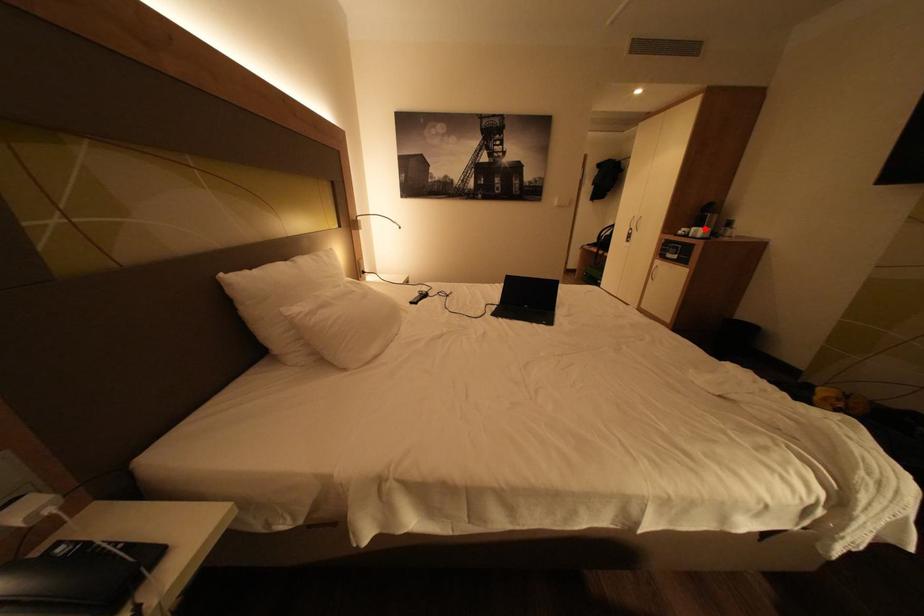
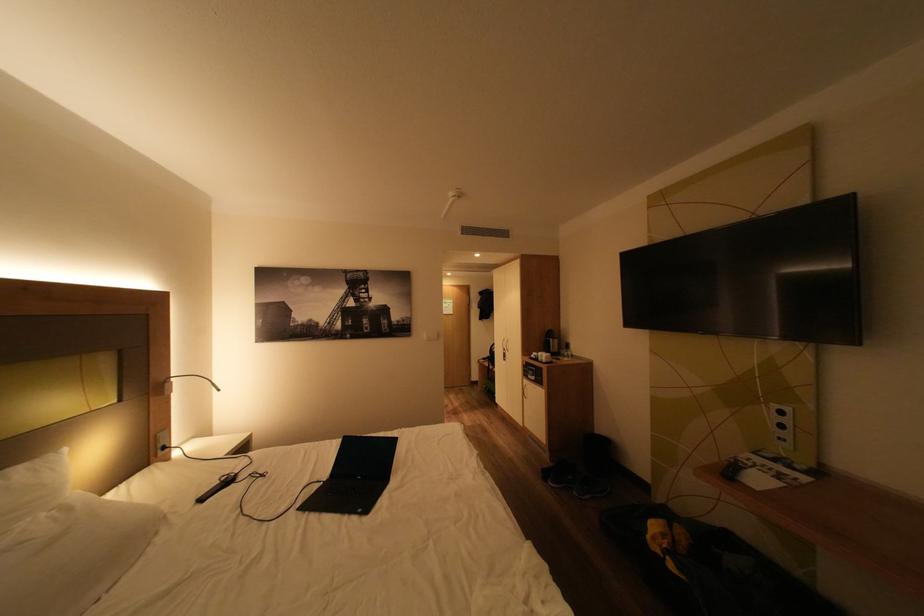
The point at the highlighted location is marked in the first image. Where is the corresponding point in the second image?

(551, 354)